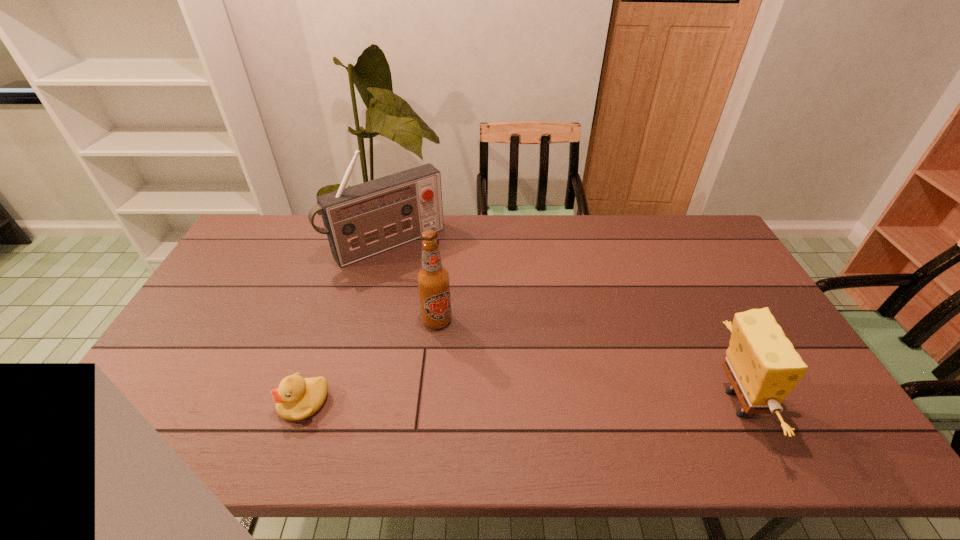
At what (x,y) coordinates should I click in order to perform the action: click on vacant region located 0.370m on the front panel of the radio receiver. Please return your answer as a coordinate pair (x, y). This screenshot has width=960, height=540. Looking at the image, I should click on (474, 335).

Where is `vacant space situated on the front panel of the radio receiver`? vacant space situated on the front panel of the radio receiver is located at coordinates (428, 282).

Image resolution: width=960 pixels, height=540 pixels. What are the coordinates of `free location located on the front panel of the radio receiver` in the screenshot? It's located at (426, 280).

Find the location of a particular element. free spot located 0.180m on the front label of the third shortest object is located at coordinates (452, 383).

Find the location of `vacant space situated on the front label of the third shortest object`. vacant space situated on the front label of the third shortest object is located at coordinates (445, 353).

Image resolution: width=960 pixels, height=540 pixels. I want to click on free space located 0.250m on the front label of the third shortest object, so click(x=458, y=407).

This screenshot has width=960, height=540. Identify the location of object located at the far edge. (360, 221).

Identify the location of duckling located in the near edge section of the desktop. (297, 398).

This screenshot has width=960, height=540. In order to click on sponge located at the near edge in this screenshot , I will do `click(761, 363)`.

You are a GUI agent. You are given a task and a screenshot of the screen. Output one action in this format:
    pyautogui.click(x=<x>, y=<y>)
    Task: Click on the object that is at the right edge
    This screenshot has height=540, width=960.
    Given the screenshot: What is the action you would take?
    pyautogui.click(x=761, y=363)